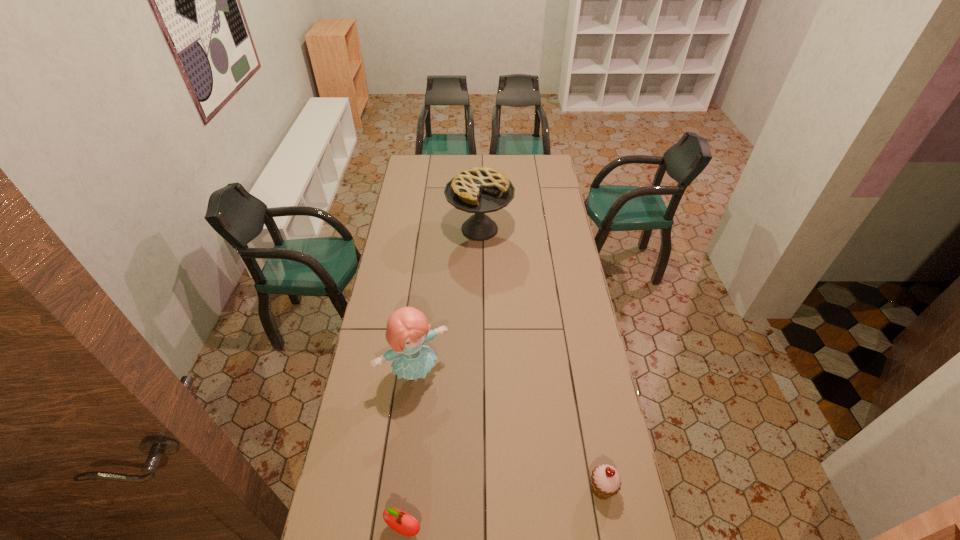
Identify the location of vacant area situated 0.060m on the front-facing side of the doll. The width and height of the screenshot is (960, 540). (441, 402).

The width and height of the screenshot is (960, 540). What are the coordinates of `object located at the near edge` in the screenshot? It's located at (605, 480).

Locate an element on the screen. This screenshot has width=960, height=540. object that is at the left edge is located at coordinates (407, 330).

Find the location of a particular element. object present at the right edge is located at coordinates (605, 480).

You are a GUI agent. You are given a task and a screenshot of the screen. Output one action in this format:
    pyautogui.click(x=<x>, y=<y>)
    Task: Click on the object present at the near right corner
    The height and width of the screenshot is (540, 960).
    Given the screenshot: What is the action you would take?
    pyautogui.click(x=605, y=480)

The width and height of the screenshot is (960, 540). In the image, there is a desktop. What are the coordinates of `vacant space at the left edge` in the screenshot? It's located at point(404,204).

Find the location of a particular element. blank space at the right edge of the desktop is located at coordinates (572, 386).

Identify the location of empty space that is in between the doll and the farthest object. (447, 300).

Locate an element on the screen. The width and height of the screenshot is (960, 540). free space that is in between the farthest object and the third nearest object is located at coordinates (447, 300).

The height and width of the screenshot is (540, 960). Find the location of `free space between the pie and the rightmost object`. free space between the pie and the rightmost object is located at coordinates pos(540,359).